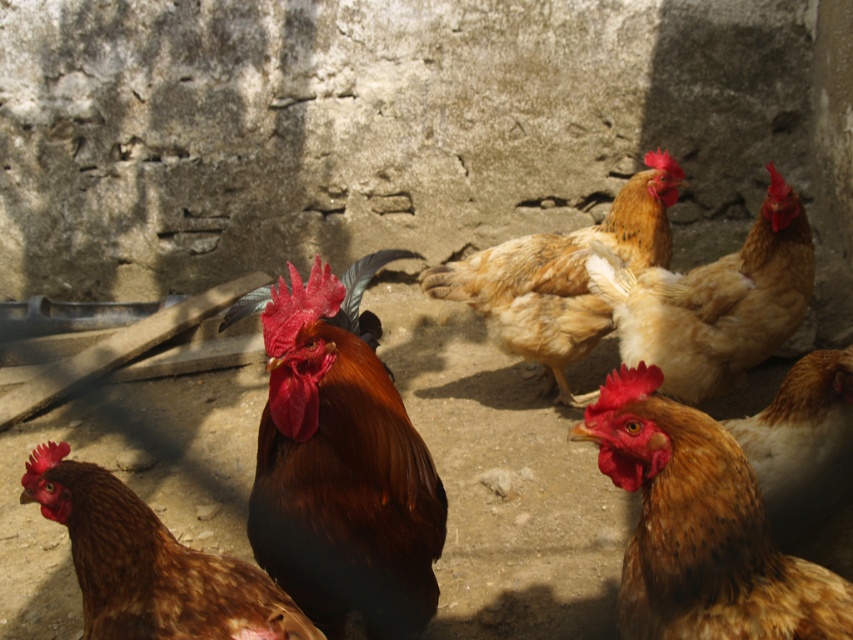
Question: Can you confirm if shiny brown rooster at center is positioned above brown feathered rooster at center?

Choices:
 (A) yes
 (B) no

Answer: (A)

Question: Does brown speckled feather at lower left appear on the left side of golden feathered chicken at center?

Choices:
 (A) yes
 (B) no

Answer: (A)

Question: Estimate the real-world distances between objects in this image. Which object is closer to the brown speckled feathers at center?

Choices:
 (A) shiny brown rooster at center
 (B) golden feathered rooster at center

Answer: (A)

Question: Is shiny brown rooster at center bigger than brown feathered rooster at center?

Choices:
 (A) yes
 (B) no

Answer: (A)

Question: Which is nearer to the brown speckled feather at lower left?

Choices:
 (A) brown feathered rooster at center
 (B) shiny brown rooster at center

Answer: (B)

Question: Which point is closer to the camera taking this photo?

Choices:
 (A) (578, 435)
 (B) (90, 611)

Answer: (A)